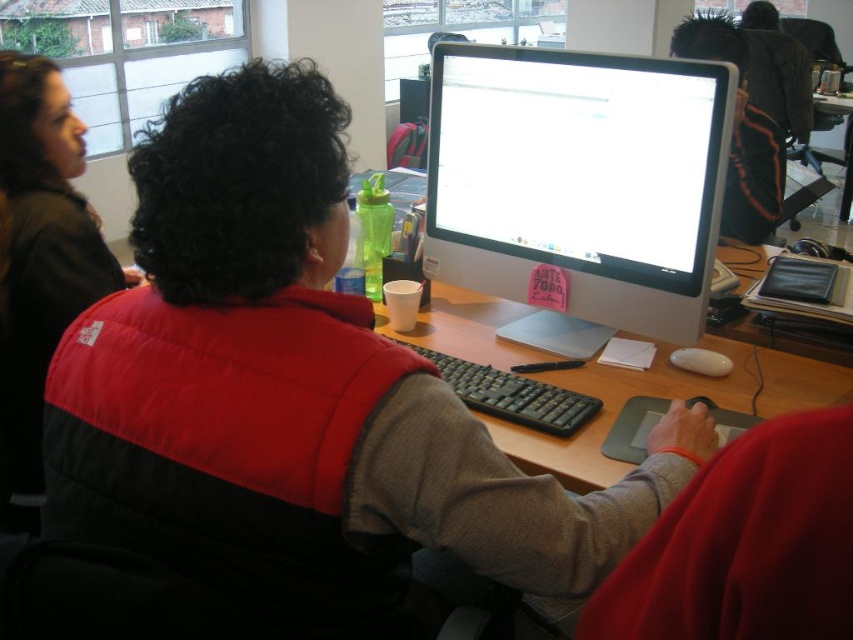
Question: Is red puffy vest at center bigger than white glossy computer monitor at center?

Choices:
 (A) yes
 (B) no

Answer: (A)

Question: Which of the following is the closest to the observer?

Choices:
 (A) white glossy computer monitor at center
 (B) black plastic keyboard at center
 (C) wooden desk at center
 (D) red puffy vest at center

Answer: (D)

Question: Considering the real-world distances, which object is closest to the red puffy vest at left?

Choices:
 (A) red puffy vest at center
 (B) black plastic keyboard at center
 (C) white glossy computer monitor at center

Answer: (A)

Question: Which object is the farthest from the red puffy vest at center?

Choices:
 (A) white glossy computer monitor at center
 (B) black plastic keyboard at center
 (C) wooden desk at center

Answer: (A)

Question: In this image, where is red puffy vest at left located relative to black plastic keyboard at center?

Choices:
 (A) below
 (B) above

Answer: (B)

Question: Can you confirm if white glossy computer monitor at center is thinner than black plastic keyboard at center?

Choices:
 (A) no
 (B) yes

Answer: (A)